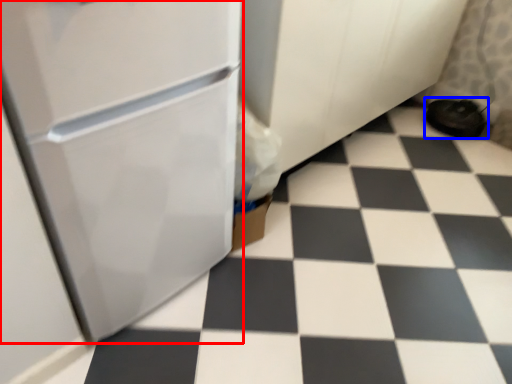
Question: Which point is further to the camera, refrigerator (highlighted by a red box) or footwear (highlighted by a blue box)?

Choices:
 (A) refrigerator
 (B) footwear

Answer: (B)